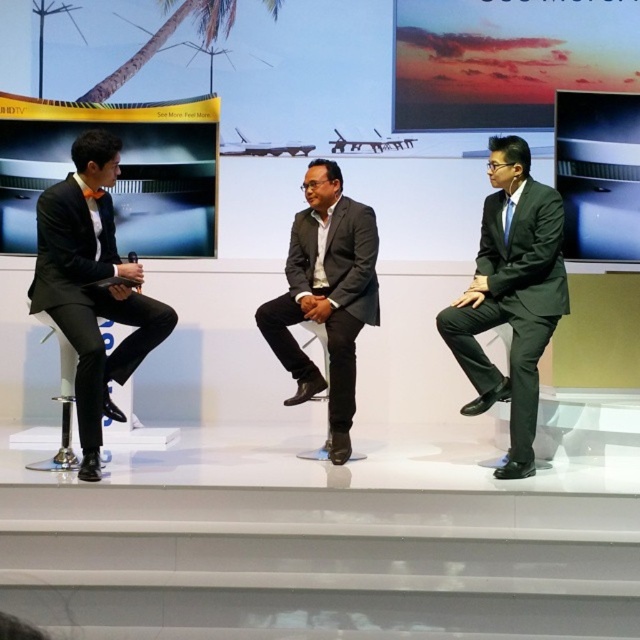
Question: Estimate the real-world distances between objects in this image. Which object is closer to the matte black suit at right?

Choices:
 (A) black matte suit at left
 (B) matte gray suit at center

Answer: (B)

Question: Which point is closer to the camera?

Choices:
 (A) (356, 269)
 (B) (497, 371)
 (C) (172, 326)

Answer: (B)

Question: Can you confirm if matte black suit at right is positioned to the left of matte gray suit at center?

Choices:
 (A) no
 (B) yes

Answer: (A)

Question: Does black matte suit at left have a larger size compared to matte gray suit at center?

Choices:
 (A) no
 (B) yes

Answer: (A)

Question: Can you confirm if matte black suit at right is positioned below matte gray suit at center?

Choices:
 (A) no
 (B) yes

Answer: (A)

Question: Which point is closer to the camera?

Choices:
 (A) matte gray suit at center
 (B) matte black suit at right

Answer: (B)